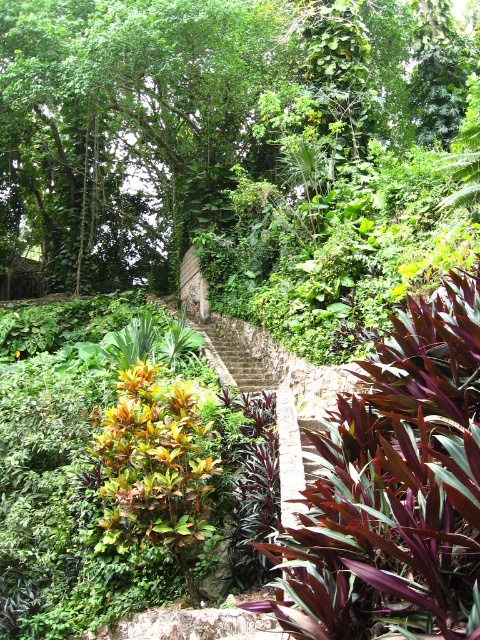
Who is positioned more to the right, green leafy tree at upper center or purple leathery leaves at center?

purple leathery leaves at center is more to the right.

What do you see at coordinates (195, 115) in the screenshot? I see `green leafy tree at upper center` at bounding box center [195, 115].

The width and height of the screenshot is (480, 640). I want to click on green leafy tree at upper center, so click(x=195, y=115).